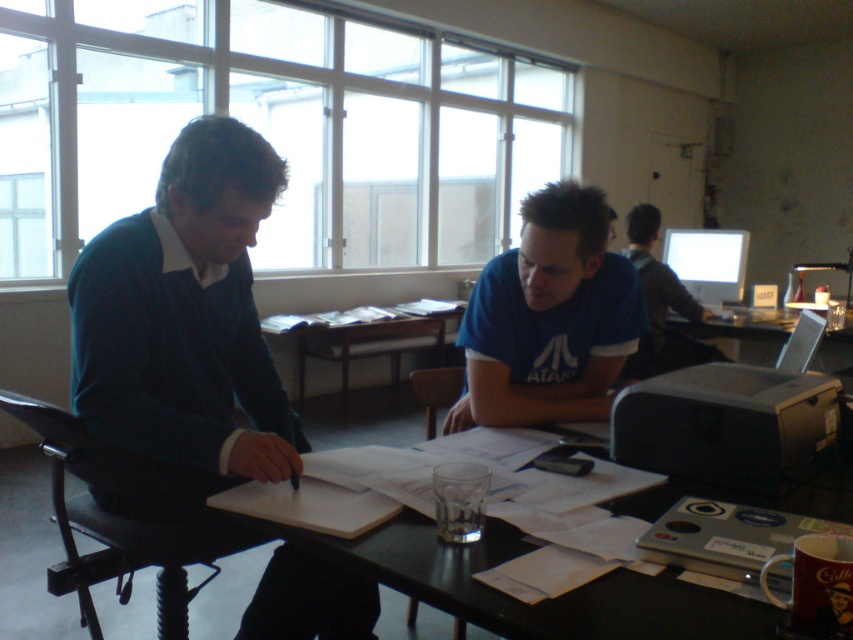
Which is behind, point (257, 353) or point (369, 554)?

The point (257, 353) is more distant.

In the scene shown: Who is shorter, dark blue sweater at left or black plastic table at center?

With less height is black plastic table at center.

Which is in front, point (192, 339) or point (643, 595)?

Point (643, 595) is more forward.

Identify the location of dark blue sweater at left. The height and width of the screenshot is (640, 853). (186, 316).

Between black plastic table at center and blue cotton shirt at center, which one has more height?

blue cotton shirt at center

Does black plastic table at center appear on the right side of blue cotton shirt at center?

Correct, you'll find black plastic table at center to the right of blue cotton shirt at center.

Which is behind, point (848, 506) or point (599, 292)?

The point (599, 292) is more distant.

Where is `black plastic table at center`? This screenshot has width=853, height=640. black plastic table at center is located at coordinates (517, 600).

The width and height of the screenshot is (853, 640). I want to click on blue cotton shirt at center, so click(x=549, y=317).

Can you confirm if blue cotton shirt at center is smaller than wooden at center?

Indeed, blue cotton shirt at center has a smaller size compared to wooden at center.

Which is in front, point (590, 209) or point (341, 376)?

Positioned in front is point (590, 209).

In order to click on blue cotton shirt at center in this screenshot , I will do `click(549, 317)`.